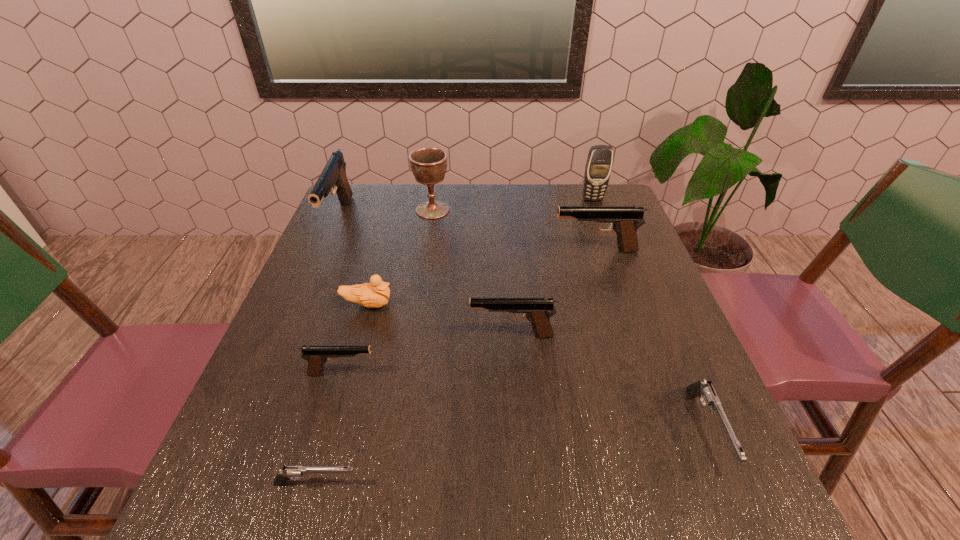
I want to click on vacant space located 0.300m at the muzzle of the third tallest pistol, so click(330, 335).

What are the coordinates of `free space located 0.280m at the muzzle of the third tallest pistol` in the screenshot? It's located at (340, 335).

The height and width of the screenshot is (540, 960). What are the coordinates of `vacant point located 0.090m at the muzzle of the third tallest pistol` in the screenshot? It's located at (428, 335).

The height and width of the screenshot is (540, 960). I want to click on vacant space located on the face of the duckling, so click(506, 305).

The image size is (960, 540). Identify the location of free space located at the muzzle of the third nearest object. (517, 373).

Locate an element on the screen. The height and width of the screenshot is (540, 960). vacant space located on the front-facing side of the shortest object is located at coordinates (390, 484).

The image size is (960, 540). What are the coordinates of `chalice located at the far edge` in the screenshot? It's located at (429, 164).

This screenshot has height=540, width=960. Find the location of `cellular telephone that is at the far edge`. cellular telephone that is at the far edge is located at coordinates (598, 167).

You are a GUI agent. You are given a task and a screenshot of the screen. Output one action in this format:
    pyautogui.click(x=<x>, y=<y>)
    Task: Click on the pistol present at the far edge
    This screenshot has width=960, height=540.
    Given the screenshot: What is the action you would take?
    (333, 175)

This screenshot has width=960, height=540. Find the location of `duckling at the left edge`. duckling at the left edge is located at coordinates (375, 294).